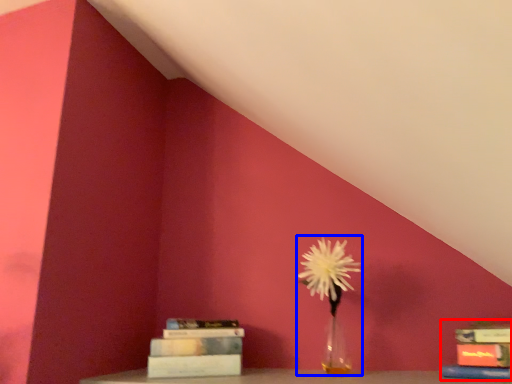
Question: Which object appears farthest to the camera in this image, book (highlighted by a red box) or floral arrangement (highlighted by a blue box)?

Choices:
 (A) book
 (B) floral arrangement

Answer: (B)